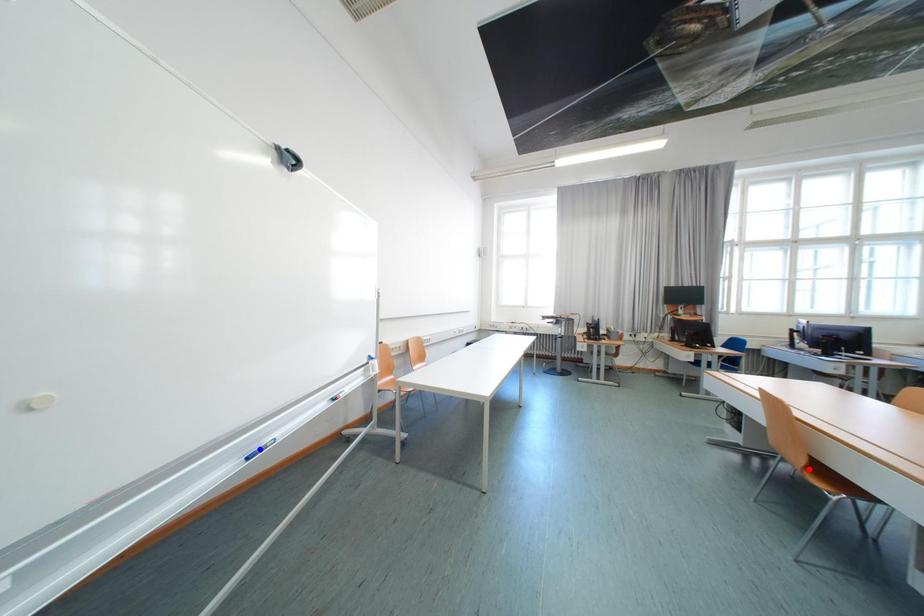
Question: In the image, two points are highlighted. Which point is nearer to the camera? Reply with the corresponding letter.

Choices:
 (A) blue point
 (B) red point

Answer: (A)